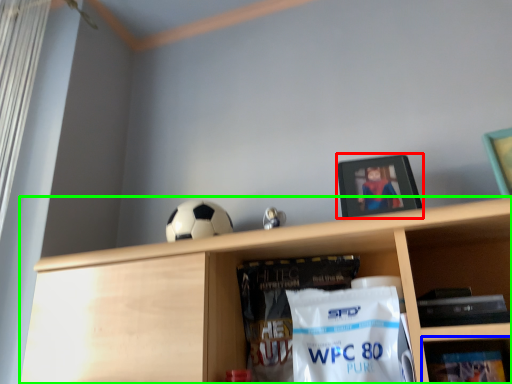
Question: Which object is positioned closest to picture frame (highlighted by a red box)? Select from shelf (highlighted by a blue box) and shelf (highlighted by a green box).

Choices:
 (A) shelf
 (B) shelf

Answer: (B)